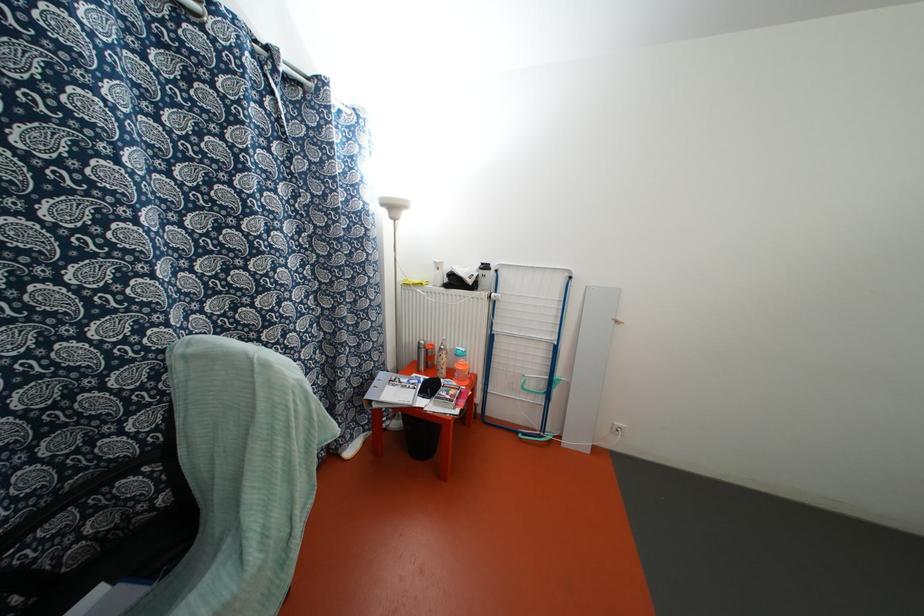
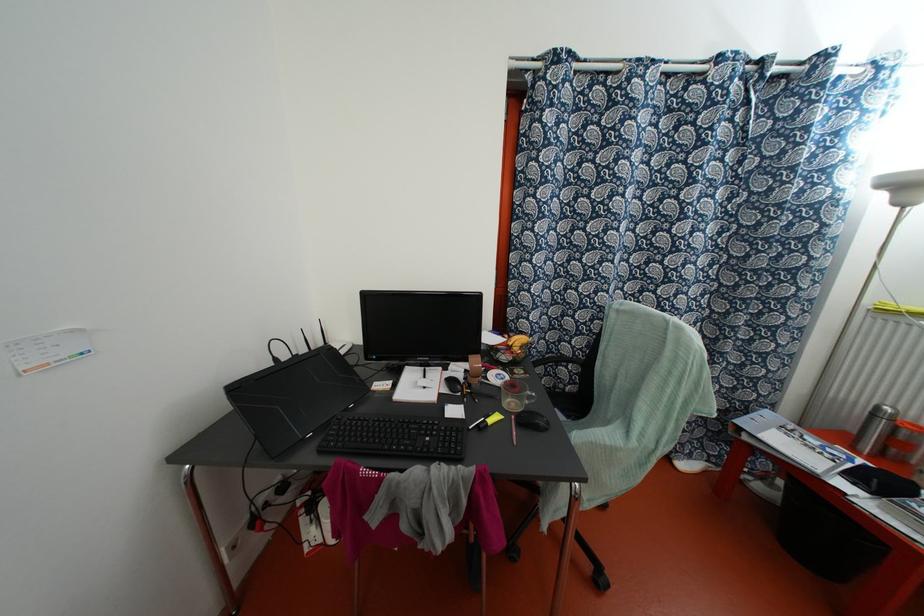
Find the pixel in the second image that matches (419,347) in the first image.

(872, 415)